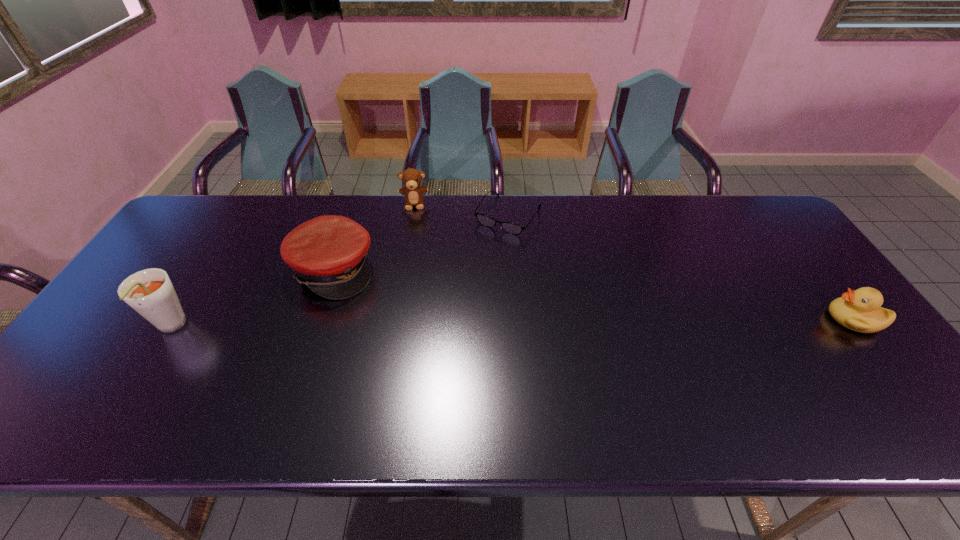
Where is `root beer`? The height and width of the screenshot is (540, 960). root beer is located at coordinates (149, 292).

Image resolution: width=960 pixels, height=540 pixels. I want to click on the tallest object, so 149,292.

The height and width of the screenshot is (540, 960). In order to click on the rightmost object in this screenshot , I will do tap(859, 310).

Where is `the second object from left to right`? The image size is (960, 540). the second object from left to right is located at coordinates (328, 253).

Locate an element on the screen. This screenshot has height=540, width=960. cap is located at coordinates (328, 253).

Identify the location of the fourth object from left to right. (512, 228).

Identify the location of the shortest object. This screenshot has height=540, width=960. (512, 228).

Where is `the third object from right to left`? The height and width of the screenshot is (540, 960). the third object from right to left is located at coordinates [411, 178].

What are the coordinates of `free space located 0.200m on the beak of the rightmost object` in the screenshot? It's located at (753, 319).

You are a GUI agent. You are given a task and a screenshot of the screen. Output one action in this format:
    pyautogui.click(x=<x>, y=<y>)
    Task: Click on the vacant space situated on the beak of the rightmost object
    Image resolution: width=960 pixels, height=540 pixels.
    Given the screenshot: What is the action you would take?
    pyautogui.click(x=756, y=319)